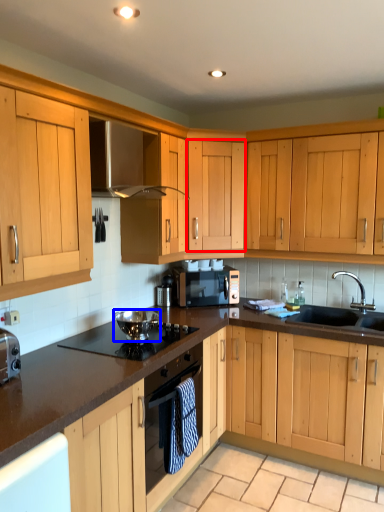
Question: Which object appears closest to the camera in this image, cabinetry (highlighted by a red box) or appliance (highlighted by a blue box)?

Choices:
 (A) cabinetry
 (B) appliance

Answer: (B)